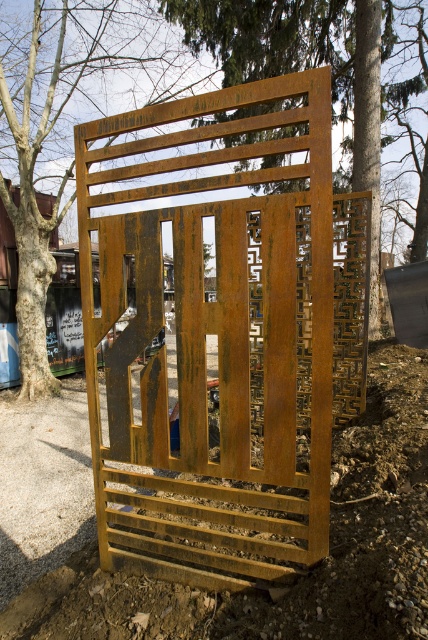
You are standing in front of the large rusted metal structure and want to touch both points on it. Which point, point [279,355] or point [23,260], will you reach first?

Point [279,355] is closer to the viewer than point [23,260], so you will reach point [279,355] first.

You are an artist trying to photograph both the rusty metal gate at center and the rusty metal tree at center from a distance. Which object will appear wider in your camera view?

The rusty metal gate at center will appear wider in your camera view because its width is larger than that of the rusty metal tree at center.

You are an artist planning to paint this scene. You want to ensure the rusty metal gate at center is visible in your painting. Given that the rusty metal tree at center is in front of it, how should you position them in your artwork?

The rusty metal gate at center is positioned under the rusty metal tree at center, so to ensure visibility, paint the rusty metal tree at center in front but make sure the rusty metal gate at center is partially visible through the gaps in the tree branches or by adjusting the tree leaves density.